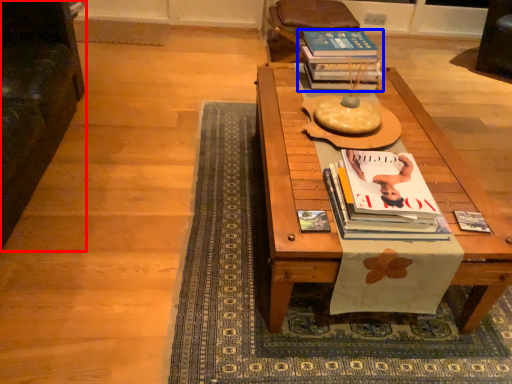
Question: Which of the following is the farthest to the observer, armchair (highlighted by a red box) or book (highlighted by a blue box)?

Choices:
 (A) armchair
 (B) book

Answer: (B)